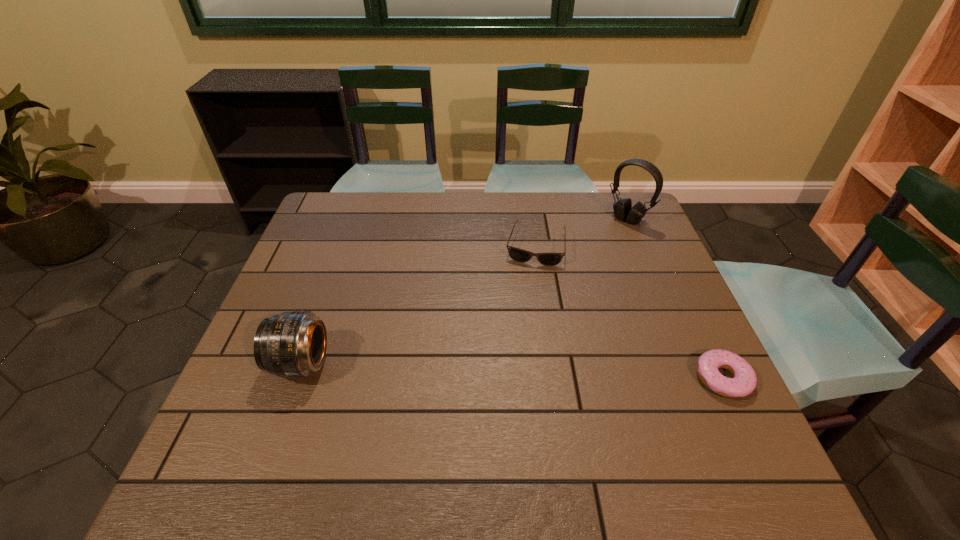
Identify the location of free space on the desktop that is between the third shortest object and the doughnut and is positioned on the lenses of the third tallest object. The image size is (960, 540). (511, 371).

The height and width of the screenshot is (540, 960). In order to click on free space on the desktop that is between the third shortest object and the shortest object and is positioned on the front-facing side of the headset in this screenshot , I will do pyautogui.click(x=472, y=369).